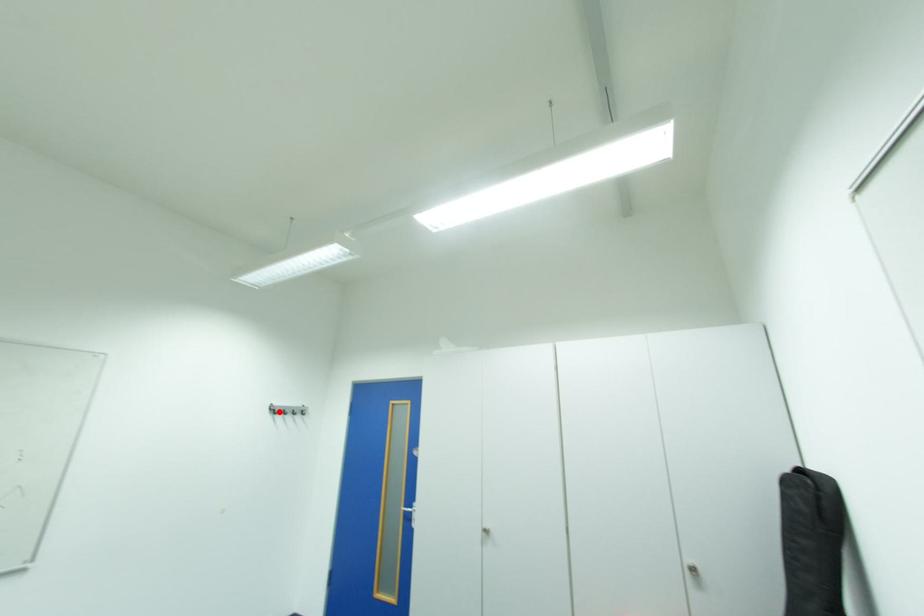
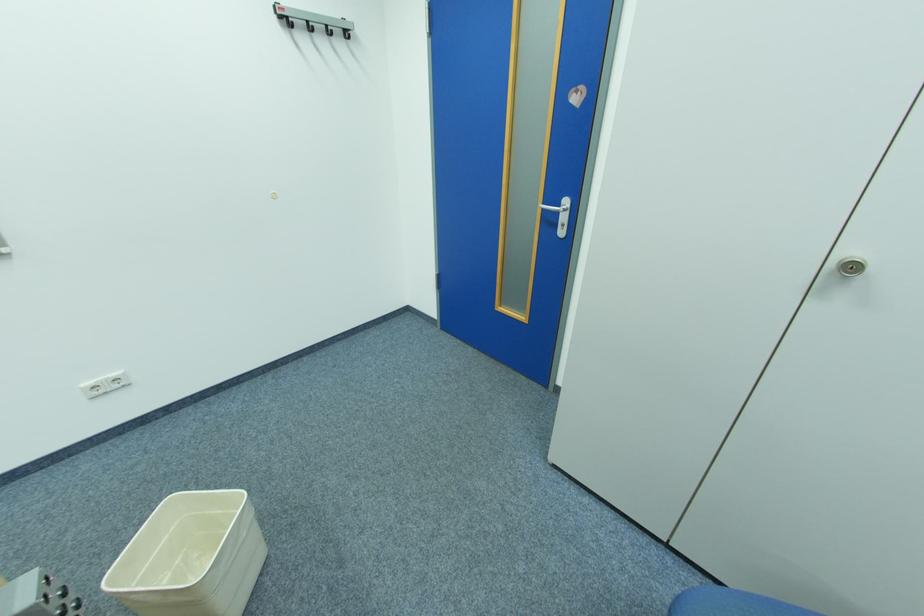
In the second image, find the point that corresponds to the highlighted location in the first image.

(290, 25)